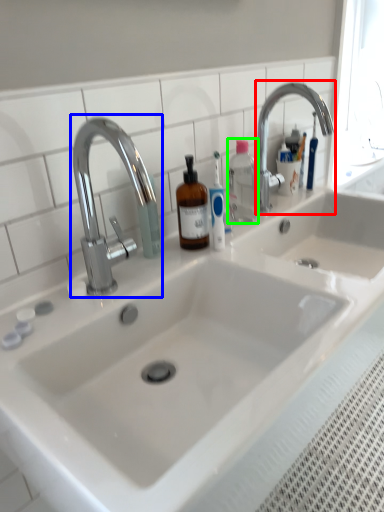
Question: Which is farther away from tap (highlighted by a red box)? tap (highlighted by a blue box) or bottle (highlighted by a green box)?

Choices:
 (A) tap
 (B) bottle

Answer: (A)